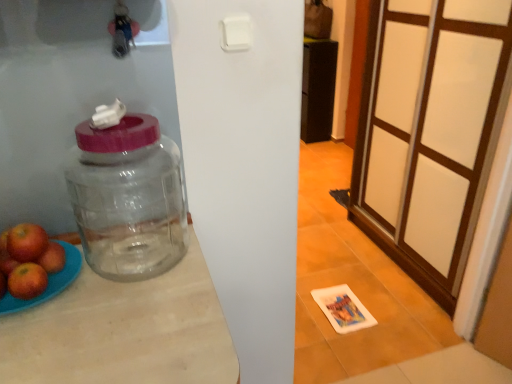
Locate an element on the screen. space that is in front of white frosted glass screen door at right is located at coordinates (386, 304).